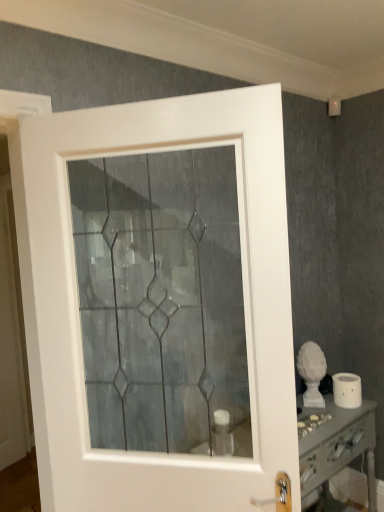
Question: Is white matte toilet paper at lower right taller or shorter than white glossy door at center?

Choices:
 (A) short
 (B) tall

Answer: (A)

Question: Which is correct: white matte toilet paper at lower right is inside white glossy door at center, or outside of it?

Choices:
 (A) outside
 (B) inside

Answer: (A)

Question: Which object is the closest to the white glossy vanity at lower right?

Choices:
 (A) white matte toilet paper at lower right
 (B) white glossy door at center

Answer: (A)

Question: Considering the real-world distances, which object is farthest from the white glossy door at center?

Choices:
 (A) white glossy vanity at lower right
 (B) white matte toilet paper at lower right

Answer: (B)